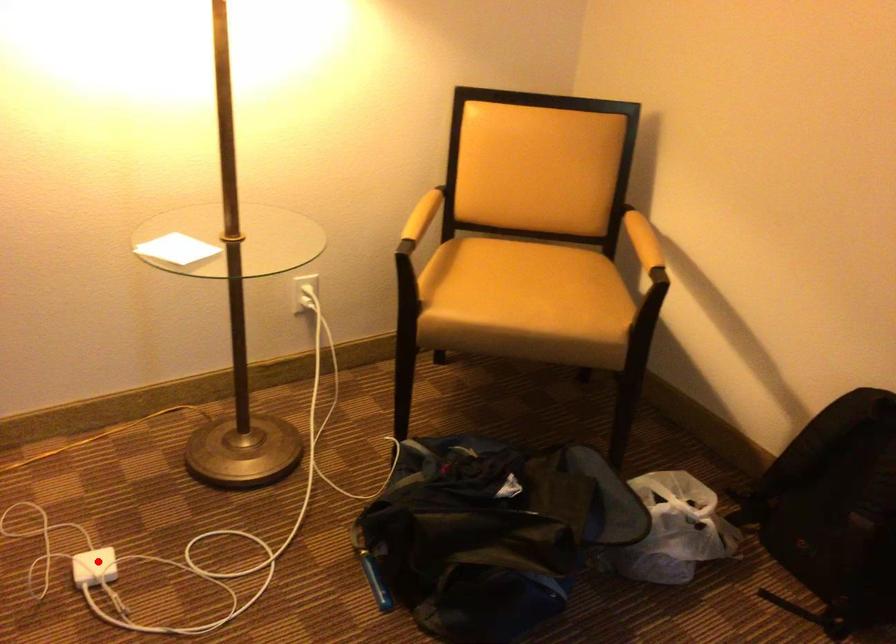
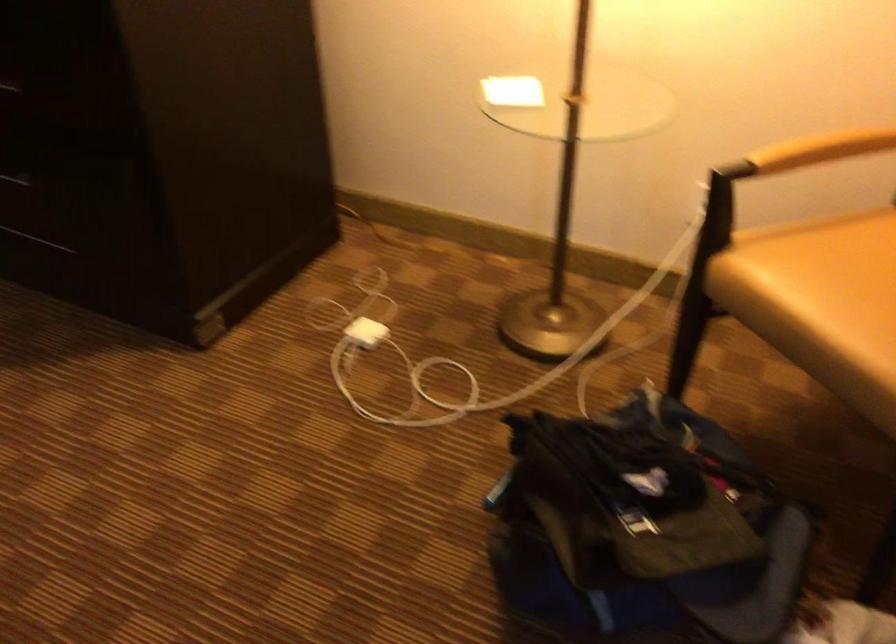
Question: A red point is marked in image1. In image2, is the corresponding 3D point closer to the camera or farther? Reply with the corresponding letter.

Choices:
 (A) The corresponding 3D point is closer.
 (B) The corresponding 3D point is farther.

Answer: (B)